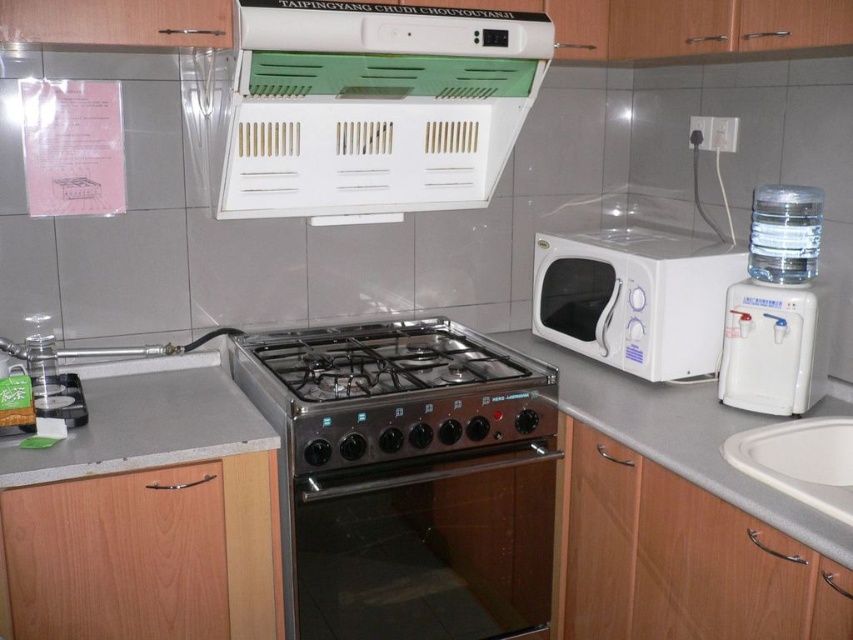
Question: Estimate the real-world distances between objects in this image. Which object is closer to the white glossy sink at lower right?

Choices:
 (A) clear plastic water filter at upper right
 (B) stainless steel gas stove at center
 (C) stainless steel oven at center

Answer: (A)

Question: Which point appears closest to the camera in this image?

Choices:
 (A) (770, 413)
 (B) (817, 241)
 (C) (724, 445)
 (D) (695, 390)

Answer: (C)

Question: Where is stainless steel oven at center located in relation to white glossy sink at lower right in the image?

Choices:
 (A) right
 (B) left

Answer: (B)

Question: Is green plastic vent at upper center further to the viewer compared to white plastic water dispenser at right?

Choices:
 (A) yes
 (B) no

Answer: (B)

Question: Can you confirm if white glossy sink at lower right is positioned to the left of clear plastic water filter at upper right?

Choices:
 (A) no
 (B) yes

Answer: (B)

Question: Which of the following is the farthest from the observer?

Choices:
 (A) gray matte countertop at center
 (B) gray laminate counter at center
 (C) clear plastic water filter at upper right

Answer: (C)